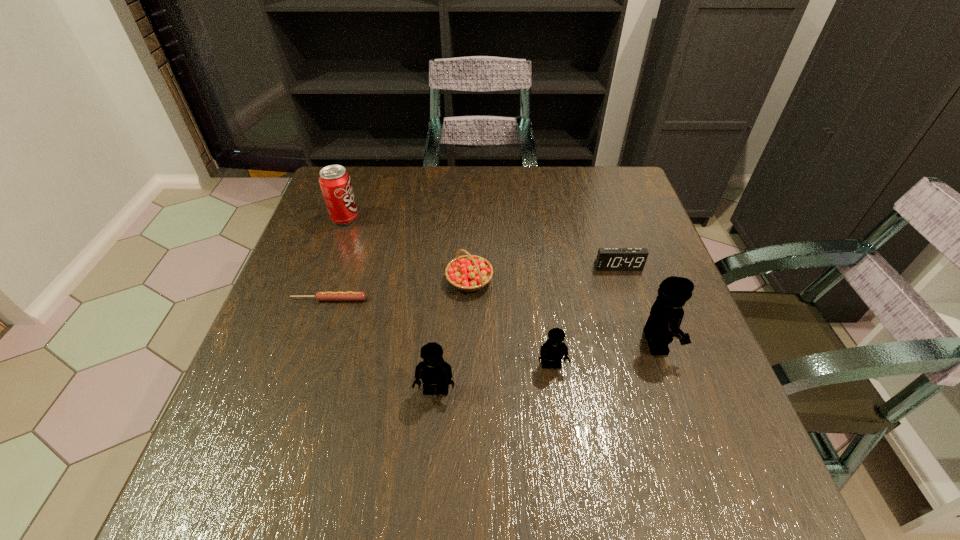
Find the location of a particular element. Image resolution: width=960 pixels, height=540 pixels. the fifth shortest object is located at coordinates (433, 370).

The width and height of the screenshot is (960, 540). What are the coordinates of `the leftmost Lego` in the screenshot? It's located at (433, 370).

The width and height of the screenshot is (960, 540). I want to click on the shortest Lego, so click(552, 351).

The width and height of the screenshot is (960, 540). Identify the location of the second Lego from left to right. (552, 351).

Where is `the tallest object`? Image resolution: width=960 pixels, height=540 pixels. the tallest object is located at coordinates (666, 314).

Identify the location of the tallest Lego. Image resolution: width=960 pixels, height=540 pixels. (666, 314).

Find the location of `strawberry`. strawberry is located at coordinates (468, 273).

Find the location of a particular element. The width and height of the screenshot is (960, 540). the shortest object is located at coordinates (320, 296).

This screenshot has width=960, height=540. What are the coordinates of `the farthest object` in the screenshot? It's located at (335, 182).

The image size is (960, 540). In order to click on the second shortest object in this screenshot , I will do `click(608, 259)`.